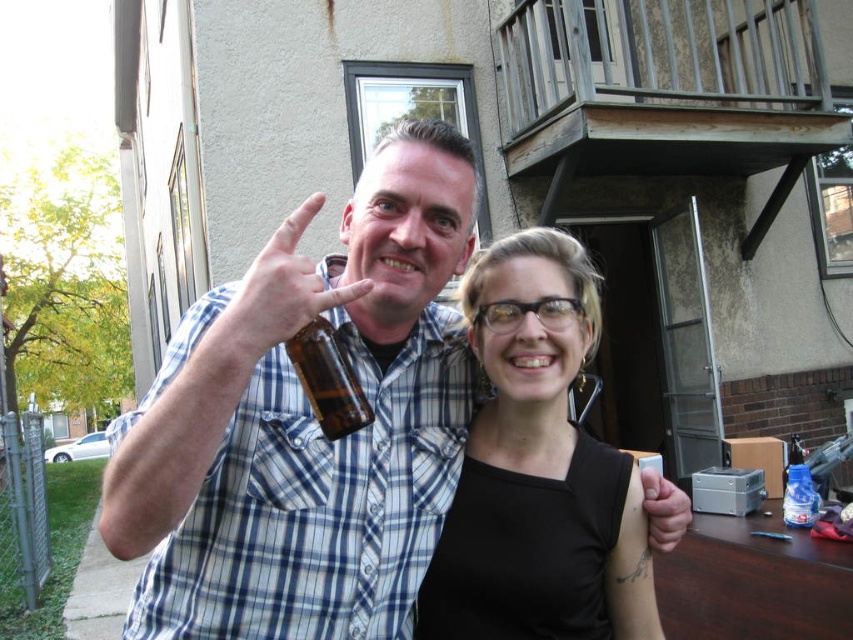
Question: Observing the image, what is the correct spatial positioning of brown glass beer bottle at center in reference to matte black hand at center?

Choices:
 (A) above
 (B) below

Answer: (A)

Question: Which object is farther from the camera taking this photo?

Choices:
 (A) matte glass beer bottle at center
 (B) matte black hand at center
 (C) brown glass beer bottle at center
 (D) brown glass bottle at center

Answer: (B)

Question: Does brown glass beer bottle at center have a smaller size compared to black matte tank top at center?

Choices:
 (A) no
 (B) yes

Answer: (A)

Question: Among these points, which one is farthest from the camera?

Choices:
 (A) (170, 516)
 (B) (314, 324)

Answer: (B)

Question: Can you confirm if matte glass beer bottle at center is positioned below matte black hand at center?

Choices:
 (A) yes
 (B) no

Answer: (B)

Question: Considering the real-world distances, which object is farthest from the brown glass bottle at center?

Choices:
 (A) black matte tank top at center
 (B) brown glass beer bottle at center
 (C) matte glass beer bottle at center
 (D) matte black hand at center

Answer: (D)